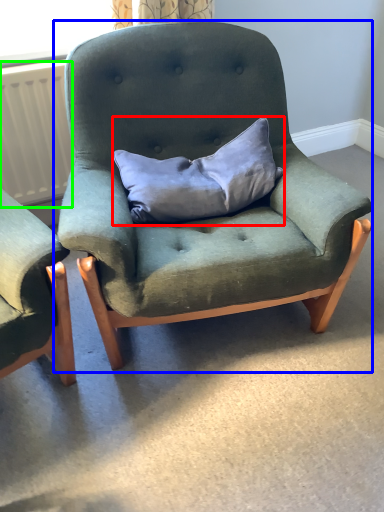
Question: Which is farther away from pillow (highlighted by a red box)? chair (highlighted by a blue box) or radiator (highlighted by a green box)?

Choices:
 (A) chair
 (B) radiator

Answer: (B)